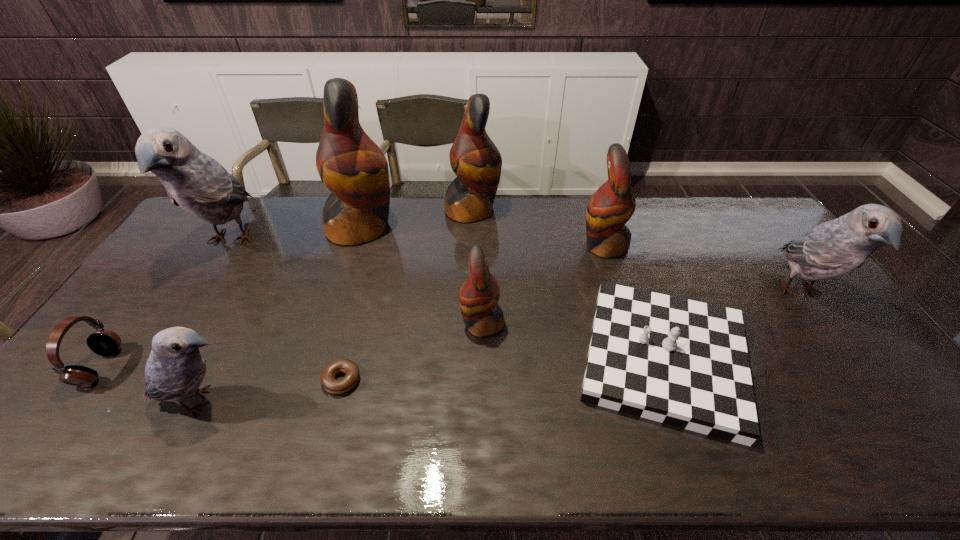
Locate an element on the screen. This screenshot has width=960, height=540. vacant region that satisfies the following two spatial constraints: 1. on the front-facing side of the rightmost parrot; 2. on the face of the nearest red parrot is located at coordinates (822, 323).